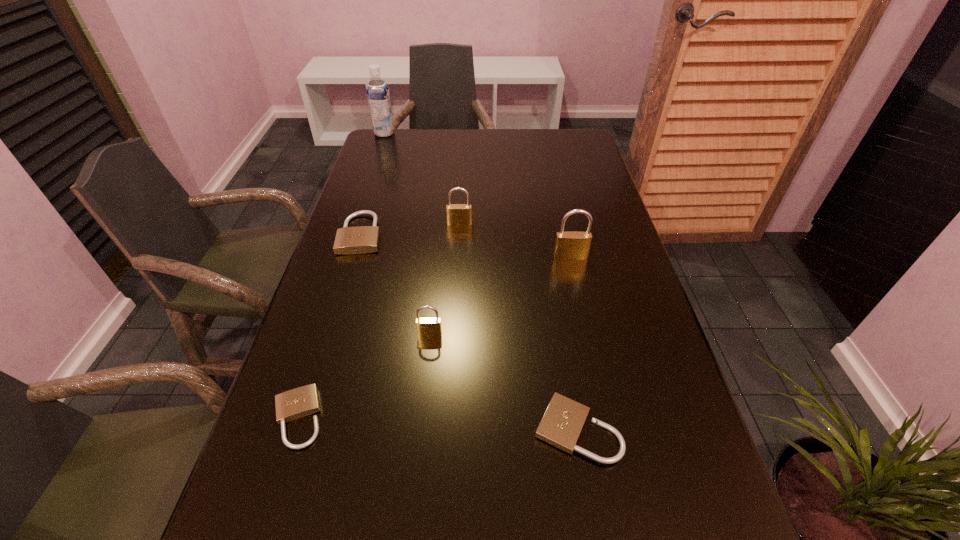
You are a GUI agent. You are given a task and a screenshot of the screen. Output one action in this format:
    pyautogui.click(x=<x>, y=<y>)
    Task: Click on the vacant region between the second shortest padlock and the tallest object
    
    Given the screenshot: What is the action you would take?
    pyautogui.click(x=481, y=281)

Locate an element on the screen. This screenshot has width=960, height=540. empty space that is in between the fourth shortest padlock and the smallest beige padlock is located at coordinates (364, 376).

In order to click on free space between the tallest object and the fourth shortest padlock in this screenshot , I will do `click(407, 233)`.

Locate an element on the screen. The width and height of the screenshot is (960, 540). empty space that is in between the shortest padlock and the farthest beige padlock is located at coordinates (329, 326).

The height and width of the screenshot is (540, 960). Identify the location of unoccupied position between the biggest brass padlock and the farthest object. (477, 195).

Select which object is the third closest to the shortest object. Please provide its 2D coordinates. Your answer should be formatted as a tuple, i.e. [(x, y)], where the tuple contains the x and y coordinates of a point satisfying the conditions above.

[(363, 239)]

Select which object is the third closest to the second tallest object. Please provide its 2D coordinates. Your answer should be formatted as a tuple, i.e. [(x, y)], where the tuple contains the x and y coordinates of a point satisfying the conditions above.

[(561, 425)]

Locate which padlock ranks fifth in proximity to the soya milk. Please provide its 2D coordinates. Your answer should be formatted as a tuple, i.e. [(x, y)], where the tuple contains the x and y coordinates of a point satisfying the conditions above.

[(303, 401)]

This screenshot has height=540, width=960. I want to click on padlock that can be found as the third closest to the third nearest padlock, so click(363, 239).

Where is `the second closest brass padlock to the second smallest beige padlock`? This screenshot has height=540, width=960. the second closest brass padlock to the second smallest beige padlock is located at coordinates (573, 245).